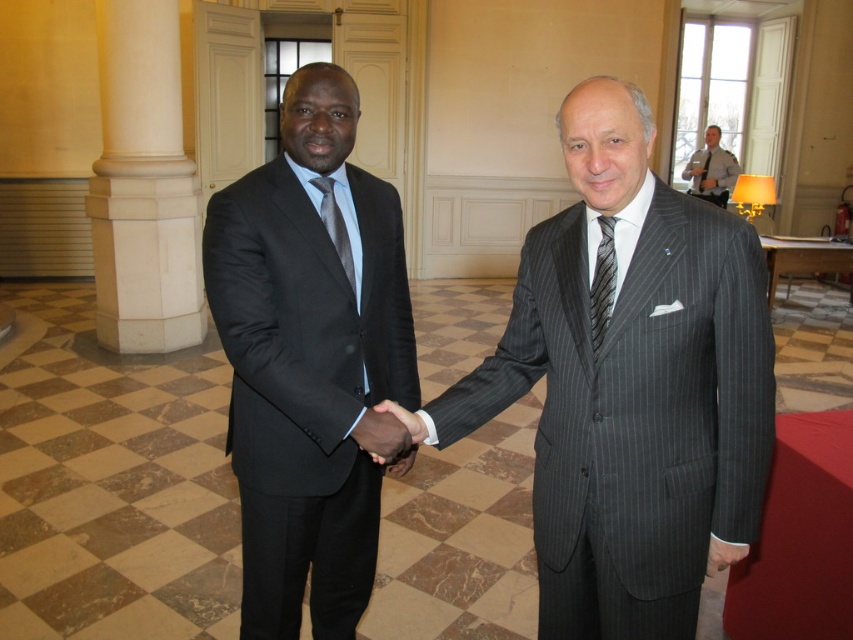
Based on the photo, does black silk hand at center appear over gray striped suit at upper right?

No, black silk hand at center is not above gray striped suit at upper right.

Can you confirm if black silk hand at center is positioned below gray striped suit at upper right?

Correct, black silk hand at center is located below gray striped suit at upper right.

At what (x,y) coordinates should I click in order to perform the action: click on black silk hand at center. Please return your answer as a coordinate pair (x, y). The height and width of the screenshot is (640, 853). Looking at the image, I should click on (396, 436).

Does point (375, 433) come closer to viewer compared to point (596, 321)?

No, (375, 433) is behind (596, 321).

Does black silk hand at center lie behind striped silk tie at center?

Yes, black silk hand at center is further from the viewer.

Is point (409, 433) positioned in front of point (598, 276)?

No, it is not.

The height and width of the screenshot is (640, 853). Identify the location of black silk hand at center. (396, 436).

Between gray striped suit at upper right and striped silk tie at center, which one appears on the right side from the viewer's perspective?

gray striped suit at upper right is more to the right.

Between gray striped suit at upper right and striped silk tie at center, which one has more height?

With more height is gray striped suit at upper right.

In order to click on gray striped suit at upper right in this screenshot , I will do `click(711, 170)`.